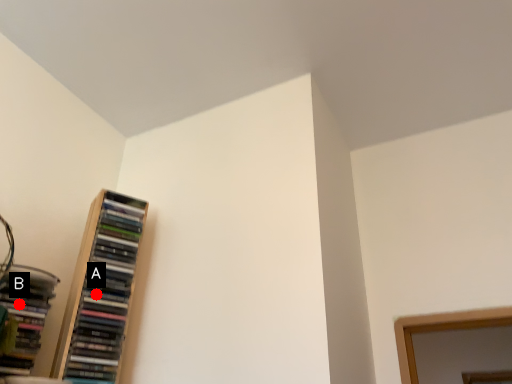
Question: Two points are circled on the image, labeled by A and B beside each circle. Which point appears farthest from the camera in this image?

Choices:
 (A) A is further
 (B) B is further

Answer: (A)